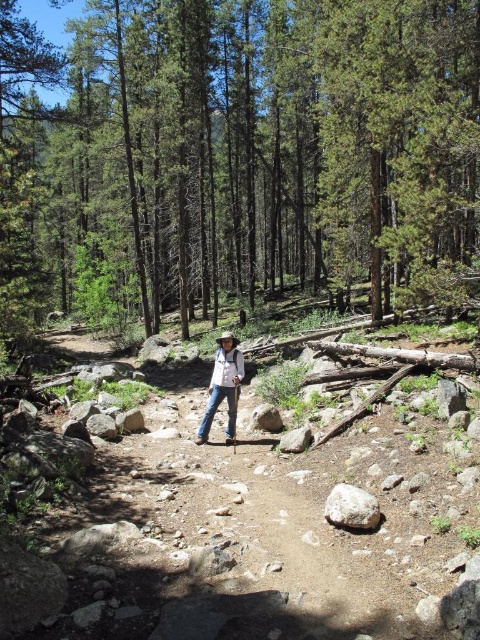
Question: Which point is farther to the camera?

Choices:
 (A) (72, 164)
 (B) (225, 332)

Answer: (A)

Question: Which of the following is the farthest from the observer?

Choices:
 (A) (152, 252)
 (B) (349, 499)

Answer: (A)

Question: Observing the image, what is the correct spatial positioning of denim jeans at center in reference to gray rough rock at center?

Choices:
 (A) below
 (B) above

Answer: (B)

Question: Does green leafy tree at center appear on the left side of gray rough rock at center?

Choices:
 (A) yes
 (B) no

Answer: (A)

Question: Which point appears farthest from the camera in this image?

Choices:
 (A) (364, 529)
 (B) (225, 396)
 (C) (309, 280)

Answer: (C)

Question: Is denim jeans at center positioned before gray rough rock at center?

Choices:
 (A) yes
 (B) no

Answer: (B)